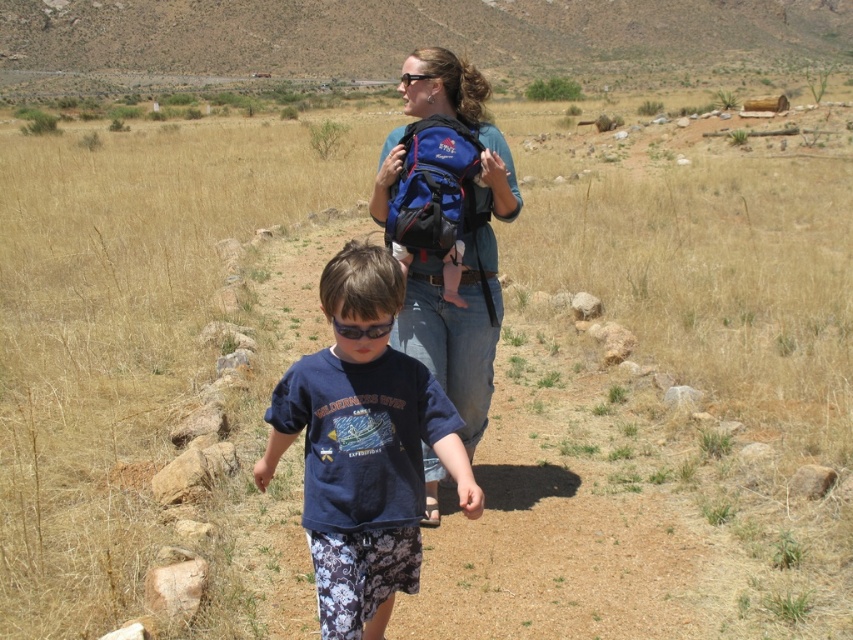
Does blue cotton shirt at center have a lesser width compared to blue fabric backpack at center?

No.

This screenshot has width=853, height=640. In order to click on blue cotton shirt at center in this screenshot , I will do `click(363, 445)`.

In order to click on blue cotton shirt at center in this screenshot , I will do `click(363, 445)`.

Does point (320, 484) lie behind point (479, 259)?

No, it is in front of (479, 259).

This screenshot has width=853, height=640. What do you see at coordinates (363, 445) in the screenshot? I see `blue cotton shirt at center` at bounding box center [363, 445].

The image size is (853, 640). In order to click on blue cotton shirt at center in this screenshot , I will do `click(363, 445)`.

Is blue fabric backpack at upper center to the right of blue fabric backpack at center from the viewer's perspective?

Indeed, blue fabric backpack at upper center is positioned on the right side of blue fabric backpack at center.

Is blue fabric backpack at upper center wider than blue fabric backpack at center?

Yes, blue fabric backpack at upper center is wider than blue fabric backpack at center.

The height and width of the screenshot is (640, 853). I want to click on blue fabric backpack at upper center, so click(x=456, y=328).